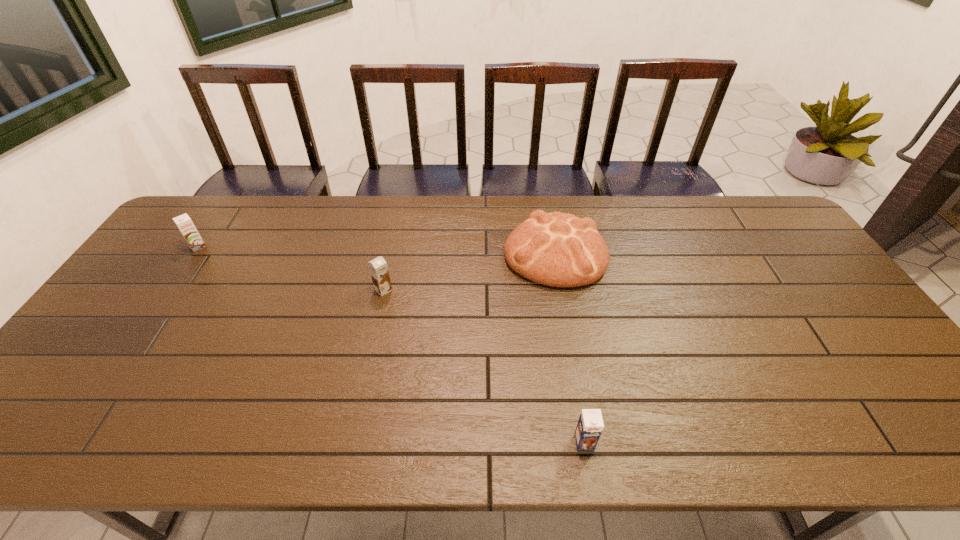
Find the location of `vacant area that satisfies the following two spatial constraints: 1. on the back side of the bread; 2. on the left side of the second farthest chocolate milk`. vacant area that satisfies the following two spatial constraints: 1. on the back side of the bread; 2. on the left side of the second farthest chocolate milk is located at coordinates (392, 253).

Locate an element on the screen. The width and height of the screenshot is (960, 540). vacant point that satisfies the following two spatial constraints: 1. on the front side of the bread; 2. on the right side of the leftmost chocolate milk is located at coordinates (194, 253).